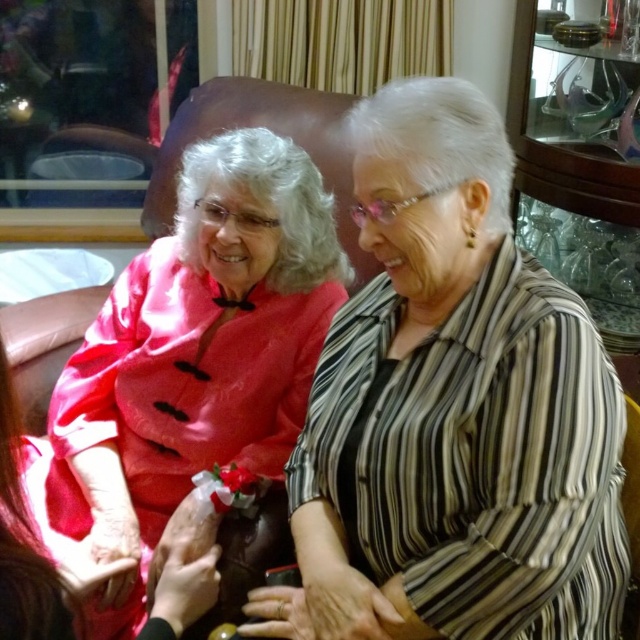
You are an interior designer observing the scene. You notice a point marked at coordinates [452,410]. Based on the scene description, what object or feature is located at that point?

The point at coordinates [452,410] indicates the location of the striped fabric at center.

You are standing in the same room as the two women and want to place a small decorative item exactly halfway between the point at (524, 376) and the point at (60, 500). Considering the spatial relationship between these points, will the decorative item be closer to the woman on the left or the woman on the right?

The decorative item placed halfway between point (524, 376) and point (60, 500) will be closer to the woman on the right because point (524, 376) is closer to the viewer than point (60, 500), so the midpoint leans towards the farther point.

You are a fashion designer observing two items in the scene. The striped fabric at center and the silky pink dress at center. Which item is narrower in width?

The striped fabric at center is thinner than the silky pink dress at center, so the striped fabric at center is narrower in width.